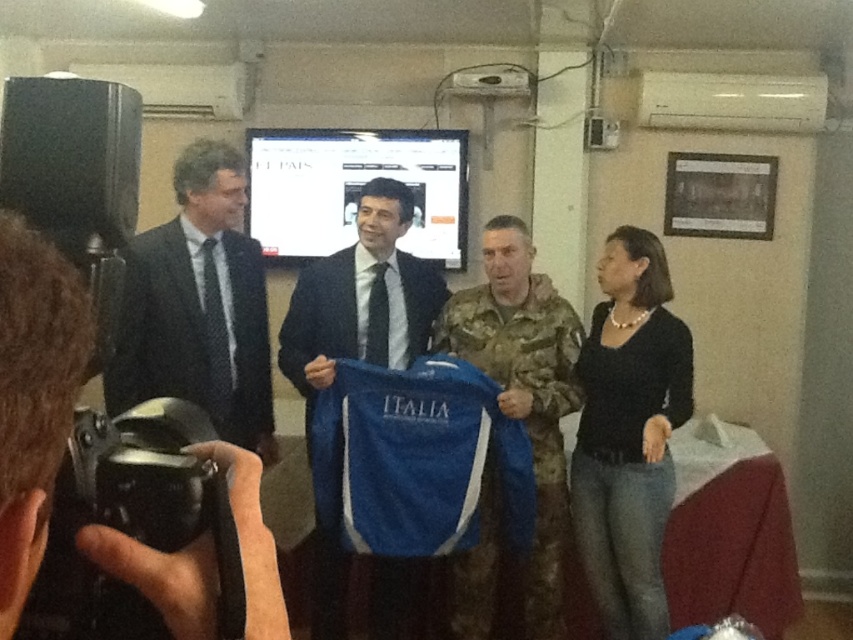
You are standing at the point marked as point (590, 403) and want to take a photo of the group of individuals in the center. Considering your camera has a focal length of 50mm and the group is 2.88 meters away from you, what is the approximate angle of view needed to capture the entire group in the photo?

The point (590, 403) and viewer are 2.88 meters apart from each other. To calculate the angle of view, use the formula angle of view formula. The angle of view required would be approximately 48 degrees.

Looking at this image, you are standing in the room and want to place a small decorative item between the black jersey at right and the black plastic video camera at lower left. Based on their positions, where should you place it?

The black jersey at right is located below the black plastic video camera at lower left, so you should place the decorative item between them in the space that is above the black jersey at right and below the black plastic video camera at lower left.